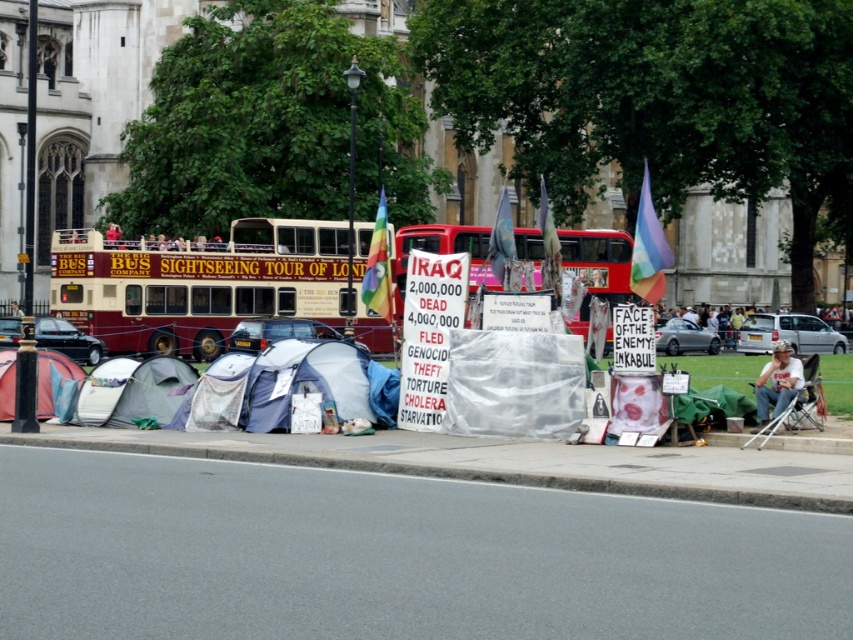
Question: Does maroon fabric double-decker bus at left appear on the left side of maroon fabric double-decker bus at center?

Choices:
 (A) no
 (B) yes

Answer: (B)

Question: Is maroon fabric double-decker bus at center positioned behind red fabric tent at lower left?

Choices:
 (A) yes
 (B) no

Answer: (B)

Question: Which of these objects is positioned closest to the concrete curb at lower center?

Choices:
 (A) red fabric tent at lower left
 (B) maroon fabric double-decker bus at center
 (C) maroon fabric double-decker bus at left

Answer: (B)

Question: Which object is closer to the camera taking this photo?

Choices:
 (A) concrete curb at lower center
 (B) red fabric tent at lower left

Answer: (A)

Question: Does maroon fabric double-decker bus at left have a lesser width compared to red fabric tent at lower left?

Choices:
 (A) yes
 (B) no

Answer: (B)

Question: Among these objects, which one is farthest from the camera?

Choices:
 (A) red fabric tent at lower left
 (B) maroon fabric double-decker bus at left

Answer: (A)